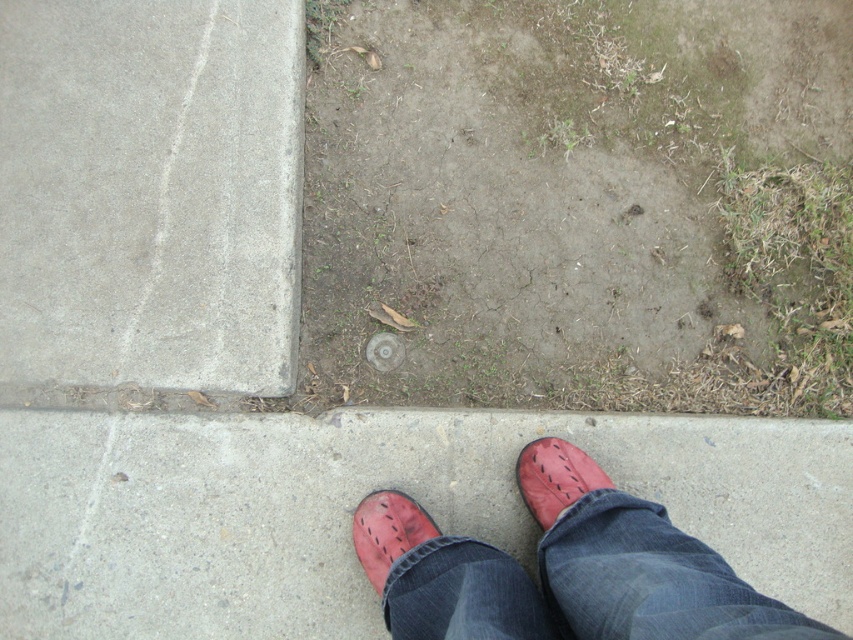
Question: Can you confirm if leather shoes at center is positioned to the right of matte leather shoe at lower center?

Choices:
 (A) no
 (B) yes

Answer: (B)

Question: Which object appears closest to the camera in this image?

Choices:
 (A) gray concrete at upper left
 (B) matte leather shoe at lower center

Answer: (B)

Question: Does leather shoes at center come behind matte leather shoe at lower center?

Choices:
 (A) no
 (B) yes

Answer: (A)

Question: Which point is closer to the camera taking this photo?

Choices:
 (A) tap(230, 138)
 (B) tap(413, 525)

Answer: (B)

Question: Observing the image, what is the correct spatial positioning of leather shoe at lower right in reference to matte leather shoe at lower center?

Choices:
 (A) above
 (B) below

Answer: (A)

Question: Which is farther from the leather shoe at lower right?

Choices:
 (A) gray concrete at upper left
 (B) leather shoes at center

Answer: (A)